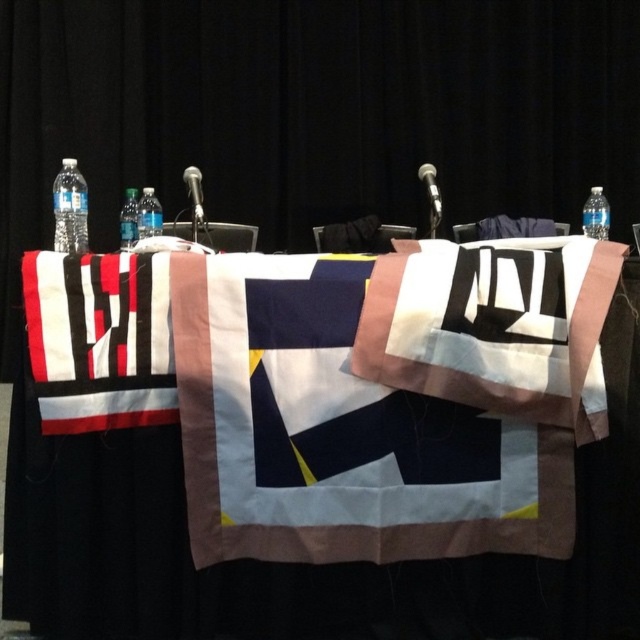
You are standing in front of the table setup for the panel discussion. There are two points marked on the table surface. The first point is at coordinates point (152, 328) and the second point is at point (65, 236). Which of these two points is closer to you?

Point (152, 328) is closer to the viewer than point (65, 236).

You are organizing a panel discussion and need to place a name tag for the moderator exactly at the center of the table. The table has a microphone stand with a microphone attached at the center. However, there is an object located at point coordinates (129,220). Is this point the best location to place the name tag without obstructing the microphone?

The point at coordinates (129,220) marks the clear plastic bottle at center, so placing the name tag there would obstruct the clear plastic bottle at center. The microphone stand with a microphone attached is at the center of the table, so the name tag should be placed there instead.

You are a speaker preparing to give a talk. You see the clear plastic bottle at left and the metallic silver microphone at upper center on the table. Which object is closer to your right side when facing the table?

The metallic silver microphone at upper center is closer to your right side because the clear plastic bottle at left is positioned to its left side.